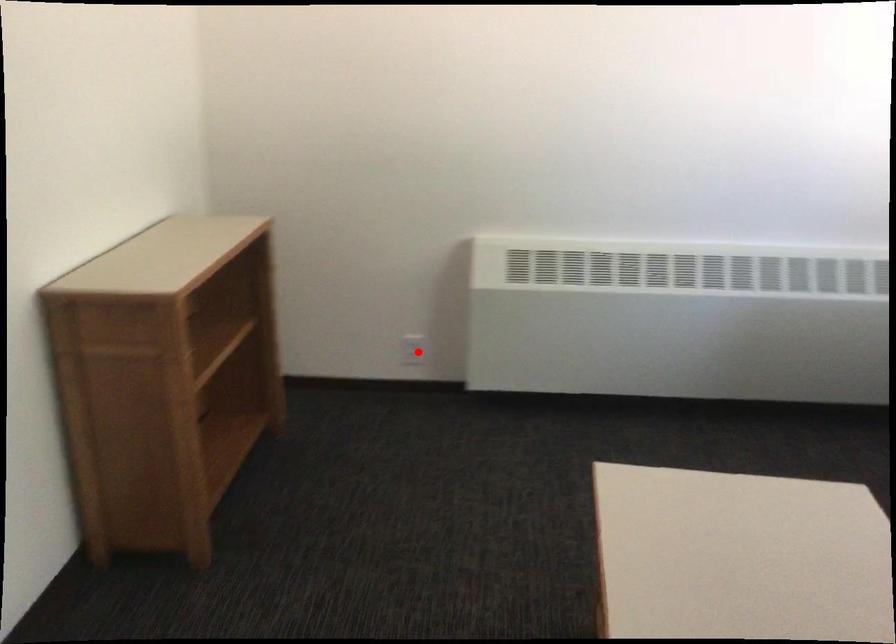
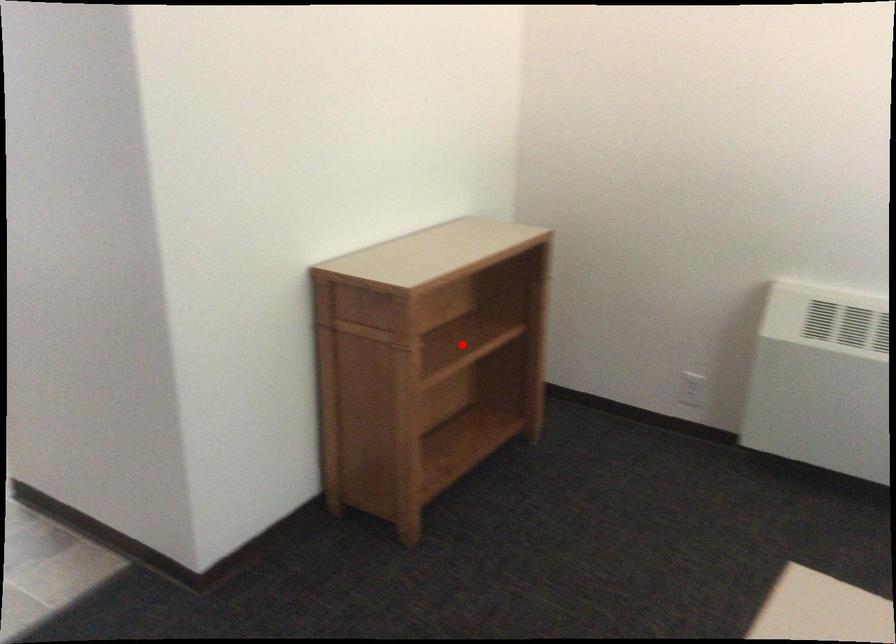
I am providing you with two images of the same scene from different viewpoints. A red point is marked on the first image and another point is marked on the second image. Is the marked point in image1 the same physical position as the marked point in image2?

No